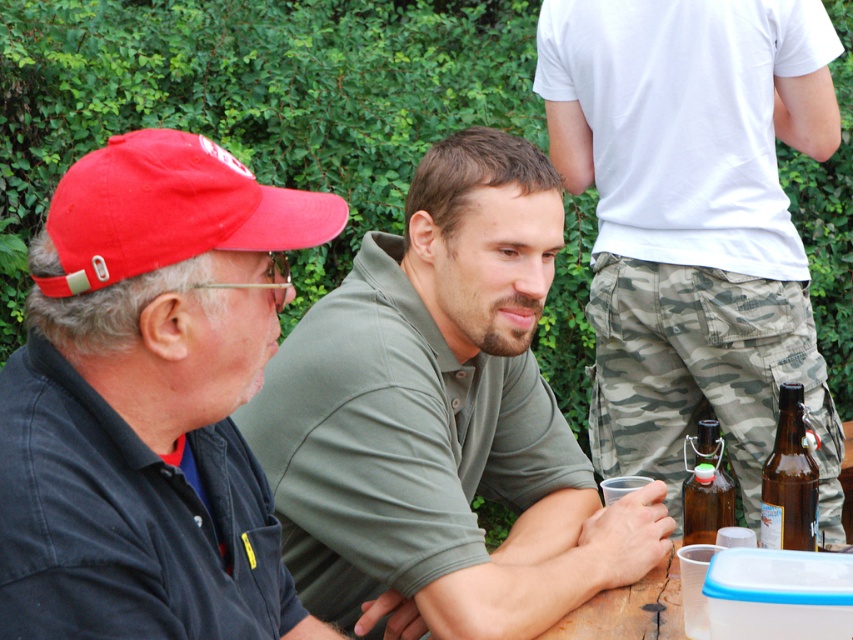
You are a photographer setting up a tripod to take a portrait of both the green cotton shirt at center and the matte black shirt at left. The tripod has a height limit of 1.5 meters. Can you adjust the tripod so that both subjects are fully visible without cropping any part of them?

The green cotton shirt at center is taller than the matte black shirt at left. Since the tripod has a height limit of 1.5 meters, you need to ensure that the tallest subject, which is the green cotton shirt at center, does not exceed this height. If the green cotton shirt at center is within or below 1.5 meters, both can be accommodated. However, if it exceeds this height, adjustments like lowering the angle or using a shorter tripod would be necessary.